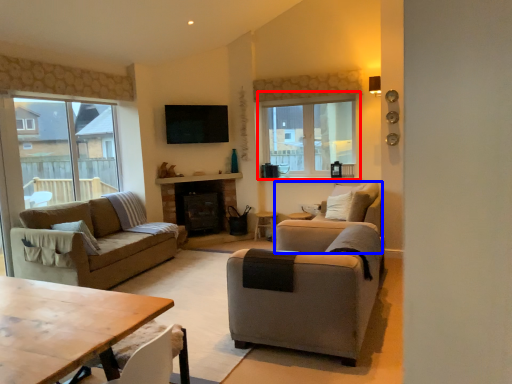
Question: Among these objects, which one is farthest to the camera, window (highlighted by a red box) or armchair (highlighted by a blue box)?

Choices:
 (A) window
 (B) armchair

Answer: (A)